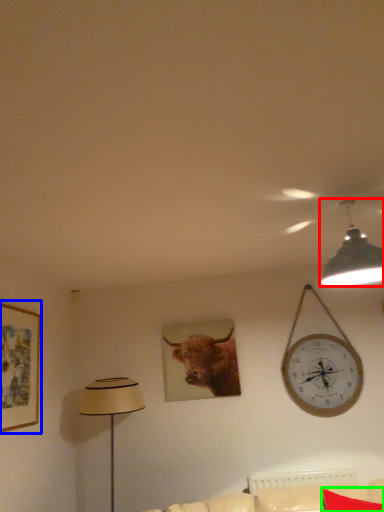
Question: Based on their relative distances, which object is farther from lamp (highlighted by a red box)? Choose from picture frame (highlighted by a blue box) and pillow (highlighted by a green box).

Choices:
 (A) picture frame
 (B) pillow

Answer: (A)